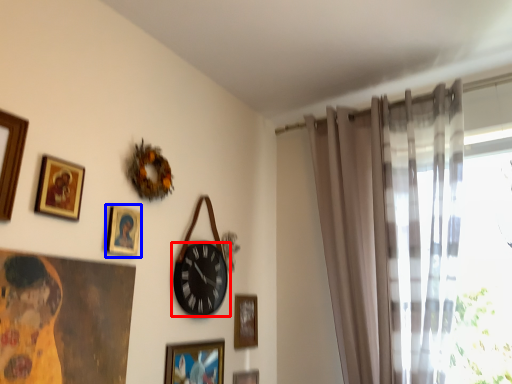
Question: Which object is further to the camera taking this photo, wall clock (highlighted by a red box) or picture frame (highlighted by a blue box)?

Choices:
 (A) wall clock
 (B) picture frame

Answer: (A)